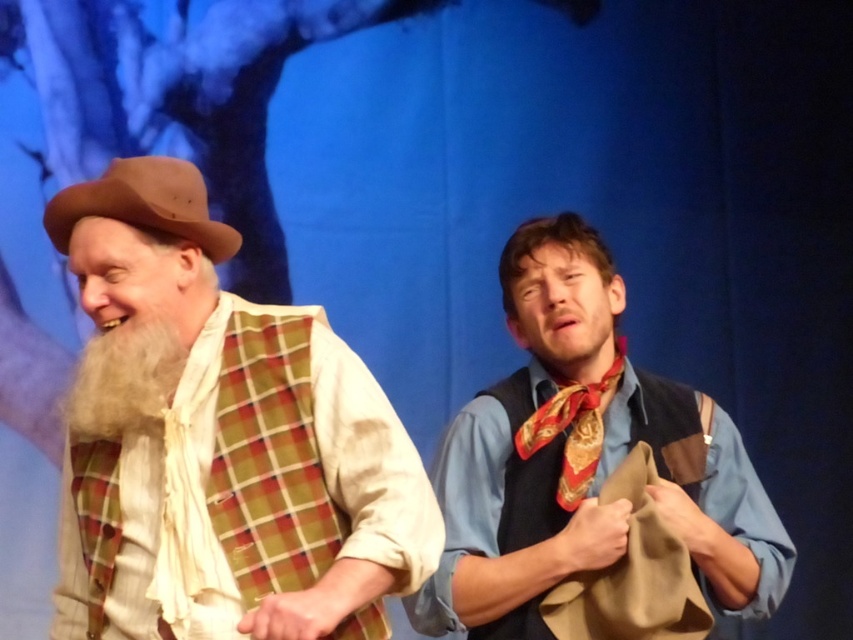
Who is shorter, brown leather cowboy hat at left or white fluffy beard at left?

brown leather cowboy hat at left is shorter.

Does brown leather cowboy hat at left have a greater height compared to white fluffy beard at left?

No, brown leather cowboy hat at left is not taller than white fluffy beard at left.

Which is in front, point (74, 208) or point (86, 388)?

Positioned in front is point (74, 208).

What are the coordinates of `brown leather cowboy hat at left` in the screenshot? It's located at (144, 204).

How much distance is there between blue denim shirt at center and gold-patterned silk tie at center?

They are 5.04 inches apart.

Which of these two, blue denim shirt at center or gold-patterned silk tie at center, stands shorter?

With less height is gold-patterned silk tie at center.

I want to click on blue denim shirt at center, so click(x=584, y=458).

Which is behind, point (537, 324) or point (143, 321)?

Point (537, 324)

Which is more to the right, blue denim shirt at center or white fluffy beard at left?

Positioned to the right is blue denim shirt at center.

Is point (543, 269) positioned before point (154, 400)?

No, (543, 269) is behind (154, 400).

The height and width of the screenshot is (640, 853). I want to click on blue denim shirt at center, so click(x=584, y=458).